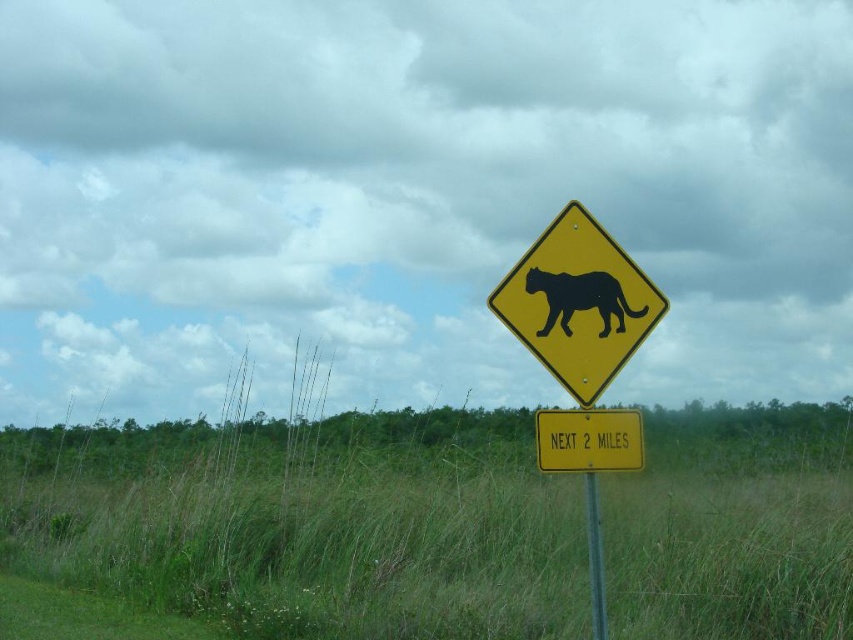
You are a driver approaching the road sign at the center. There is a point at coordinates (589,440). What object is located at this point?

The yellow yellowish metal texture sign at center is located at point (589,440).

You are a driver approaching the sign located at point (589, 440). The sign has a panther silhouette. What does this sign indicate?

The yellow sign at center with a panther silhouette indicates a wildlife crossing area ahead, specifically for panthers, and the smaller sign below it warns that the next 2 miles may have wildlife present.